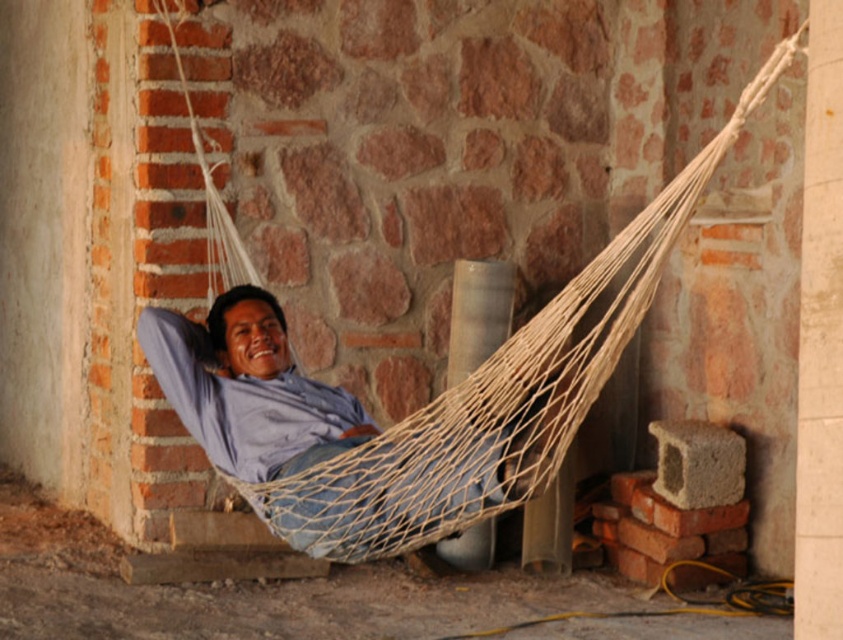
Question: Which point is farther to the camera?

Choices:
 (A) natural fiber hammock at center
 (B) white concrete pillar at center
 (C) smooth concrete pillar at center
 (D) blue cotton shirt at center

Answer: (B)

Question: Can you confirm if blue cotton shirt at center is positioned below smooth concrete pillar at center?

Choices:
 (A) no
 (B) yes

Answer: (B)

Question: From the image, what is the correct spatial relationship of smooth concrete pillar at center in relation to white concrete pillar at center?

Choices:
 (A) above
 (B) below

Answer: (B)

Question: Is smooth concrete pillar at center bigger than white concrete pillar at center?

Choices:
 (A) no
 (B) yes

Answer: (A)

Question: Estimate the real-world distances between objects in this image. Which object is closer to the natural fiber hammock at center?

Choices:
 (A) white concrete pillar at center
 (B) blue cotton shirt at center
 (C) smooth concrete pillar at center

Answer: (B)

Question: Which object is positioned closest to the smooth concrete pillar at center?

Choices:
 (A) white concrete pillar at center
 (B) blue cotton shirt at center
 (C) natural fiber hammock at center

Answer: (C)